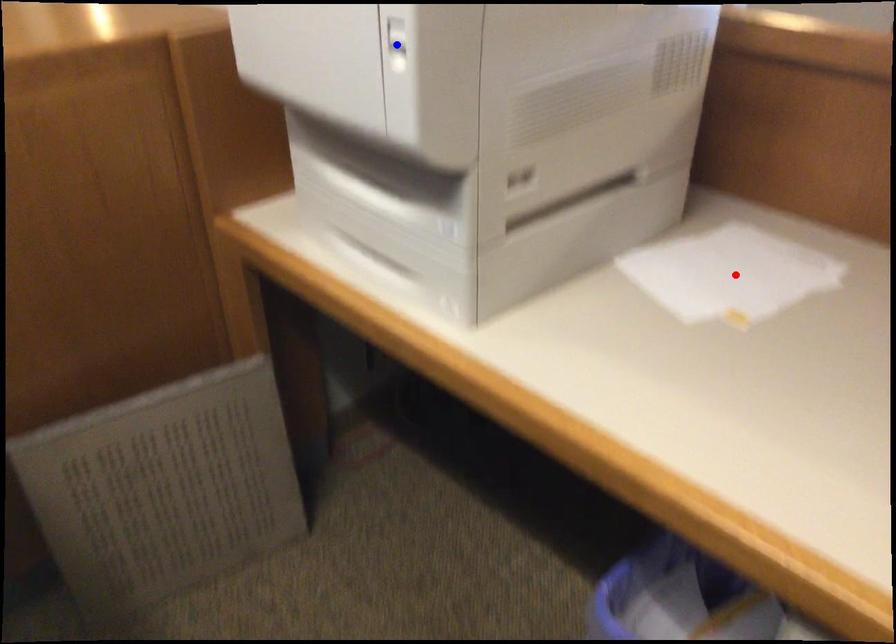
Question: Which of the two points in the image is closer to the camera?

Choices:
 (A) Blue point is closer.
 (B) Red point is closer.

Answer: (A)